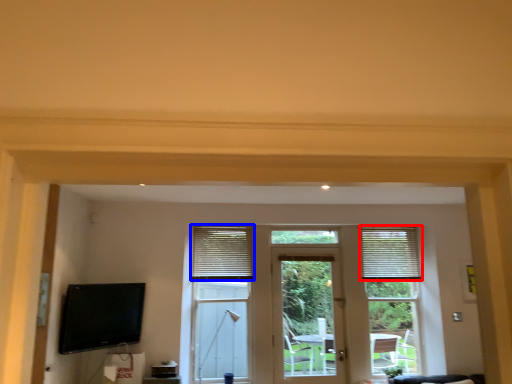
Question: Which of the following is the farthest to the observer, window blind (highlighted by a red box) or window blind (highlighted by a blue box)?

Choices:
 (A) window blind
 (B) window blind

Answer: (A)